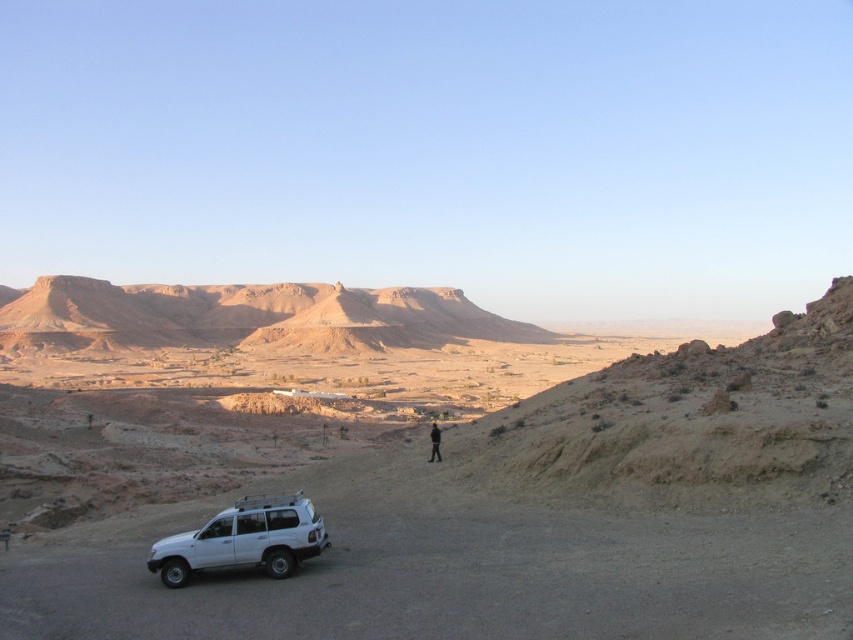
Question: Is brown rocky mountain at upper center to the left of white matte jeep at lower left from the viewer's perspective?

Choices:
 (A) yes
 (B) no

Answer: (A)

Question: Among these objects, which one is nearest to the camera?

Choices:
 (A) white matte jeep at lower left
 (B) brown rocky mountain at upper center

Answer: (A)

Question: Is brown rocky mountain at upper center further to camera compared to white matte jeep at lower left?

Choices:
 (A) yes
 (B) no

Answer: (A)

Question: Does white matte jeep at lower left have a greater width compared to black fabric person at center?

Choices:
 (A) yes
 (B) no

Answer: (A)

Question: Which point is farther to the camera?

Choices:
 (A) white matte jeep at lower left
 (B) black fabric person at center

Answer: (B)

Question: Which point is closer to the camera taking this photo?

Choices:
 (A) (236, 564)
 (B) (39, 340)

Answer: (A)